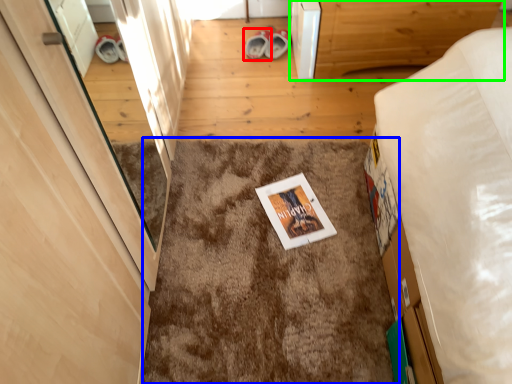
Question: Which object is the closest to the footwear (highlighted by a red box)? Choose among these: mat (highlighted by a blue box) or furniture (highlighted by a green box).

Choices:
 (A) mat
 (B) furniture

Answer: (B)